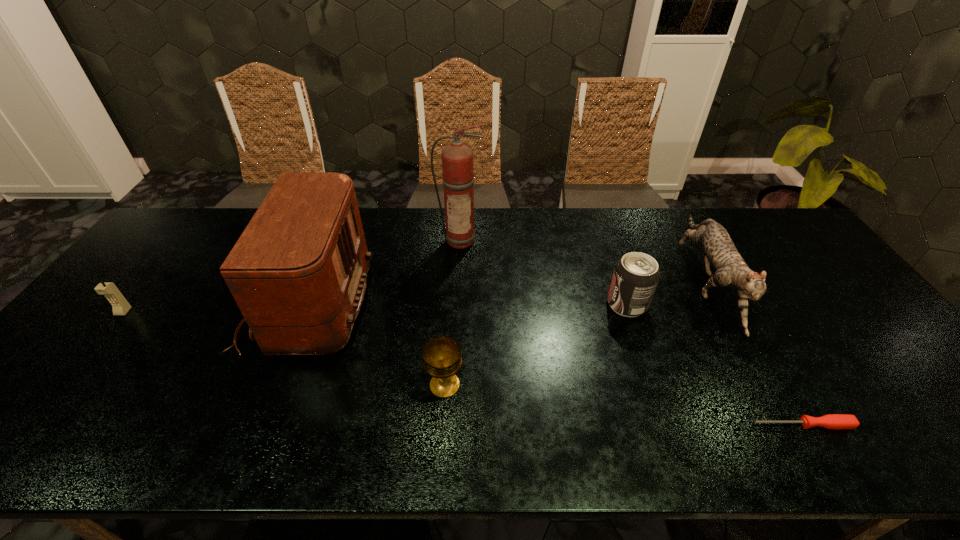
Locate an element on the screen. This screenshot has width=960, height=540. blank area in the image that satisfies the following two spatial constraints: 1. on the side of the fire extinguisher with the label and nozzle; 2. on the right side of the soda can is located at coordinates (457, 304).

I want to click on vacant region that satisfies the following two spatial constraints: 1. on the front panel of the radio receiver; 2. on the right side of the fifth object from left to right, so click(307, 304).